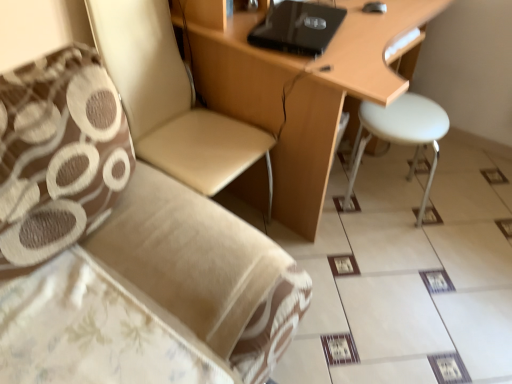
Find the location of a particular element. vacant area on top of black matte laptop at upper center (from a real-world perspective) is located at coordinates (300, 9).